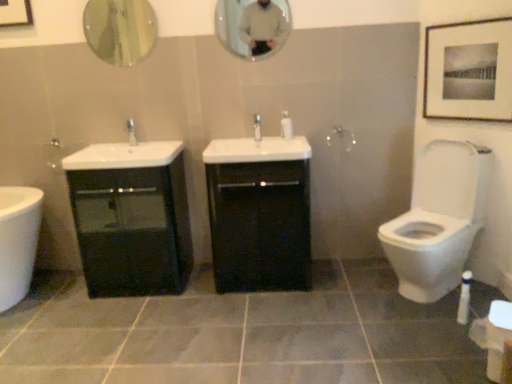
This screenshot has height=384, width=512. I want to click on empty space that is ontop of gray matte tile at center (from a real-world perspective), so click(x=242, y=319).